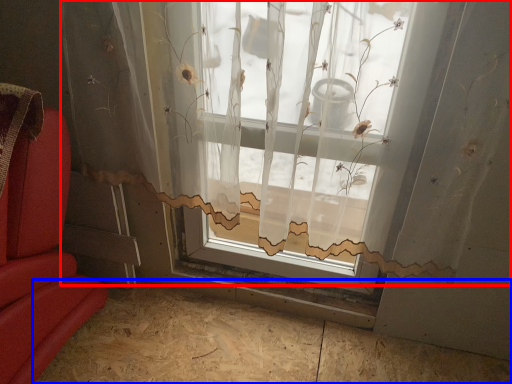
Question: Among these objects, which one is nearest to the camera, window (highlighted by a red box) or plywood (highlighted by a blue box)?

Choices:
 (A) window
 (B) plywood

Answer: (A)